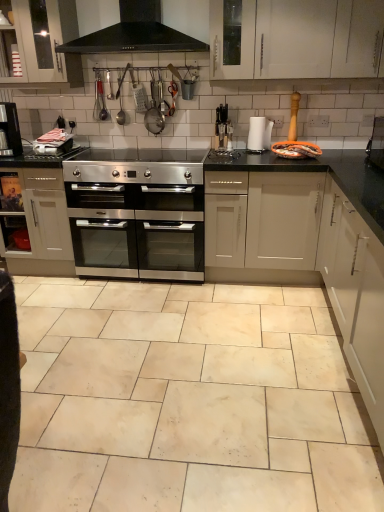
Question: Which direction should I rotate to face white paper towel at center, positioned as the first appliance in right-to-left order, — up or down?

Choices:
 (A) down
 (B) up

Answer: (B)

Question: Could you tell me if black plastic coffee machine at center, the 2th appliance when ordered from right to left, is turned towards beige marble tile at center?

Choices:
 (A) no
 (B) yes

Answer: (A)

Question: Would you say black plastic coffee machine at center, which is the 1th appliance from left to right, is outside beige marble tile at center?

Choices:
 (A) no
 (B) yes

Answer: (B)

Question: Is black plastic coffee machine at center, the 2th appliance when ordered from right to left, shorter than beige marble tile at center?

Choices:
 (A) yes
 (B) no

Answer: (B)

Question: Could beige marble tile at center be considered to be inside black plastic coffee machine at center, the 2th appliance when ordered from right to left?

Choices:
 (A) no
 (B) yes

Answer: (A)

Question: From a real-world perspective, is black plastic coffee machine at center, which is the 1th appliance from left to right, on top of beige marble tile at center?

Choices:
 (A) no
 (B) yes

Answer: (B)

Question: From the image's perspective, is black plastic coffee machine at center, which is the 1th appliance from left to right, located above beige marble tile at center?

Choices:
 (A) no
 (B) yes

Answer: (B)

Question: Is black matte exhaust hood at upper center smaller than black plastic coffee machine at center, the 2th appliance when ordered from right to left?

Choices:
 (A) yes
 (B) no

Answer: (B)

Question: Considering the relative sizes of black matte exhaust hood at upper center and black plastic coffee machine at center, which is the 1th appliance from left to right, in the image provided, is black matte exhaust hood at upper center taller than black plastic coffee machine at center, which is the 1th appliance from left to right,?

Choices:
 (A) yes
 (B) no

Answer: (A)

Question: Considering the relative sizes of black matte exhaust hood at upper center and black plastic coffee machine at center, the 2th appliance when ordered from right to left, in the image provided, is black matte exhaust hood at upper center bigger than black plastic coffee machine at center, the 2th appliance when ordered from right to left,?

Choices:
 (A) yes
 (B) no

Answer: (A)

Question: From the image's perspective, is black matte exhaust hood at upper center located beneath black plastic coffee machine at center, which is the 1th appliance from left to right?

Choices:
 (A) no
 (B) yes

Answer: (A)

Question: Does black matte exhaust hood at upper center come behind black plastic coffee machine at center, which is the 1th appliance from left to right?

Choices:
 (A) yes
 (B) no

Answer: (B)

Question: From a real-world perspective, is black matte exhaust hood at upper center positioned under black plastic coffee machine at center, the 2th appliance when ordered from right to left, based on gravity?

Choices:
 (A) yes
 (B) no

Answer: (B)

Question: Does white glossy cabinet at upper left, marked as the 1th cabinetry in a top-to-bottom arrangement, appear on the right side of satin silver oven at center, the first cabinetry viewed from the left?

Choices:
 (A) no
 (B) yes

Answer: (B)